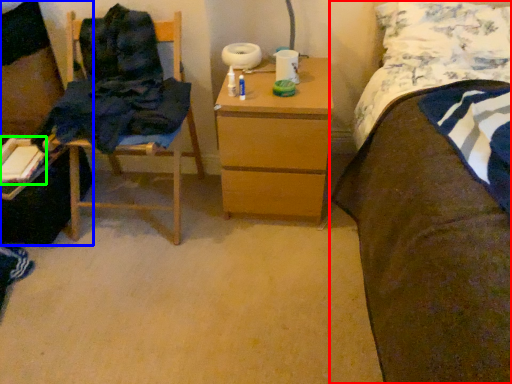
Question: Considering the real-world distances, which object is closest to bed (highlighted by a red box)? desk (highlighted by a blue box) or book (highlighted by a green box).

Choices:
 (A) desk
 (B) book

Answer: (B)